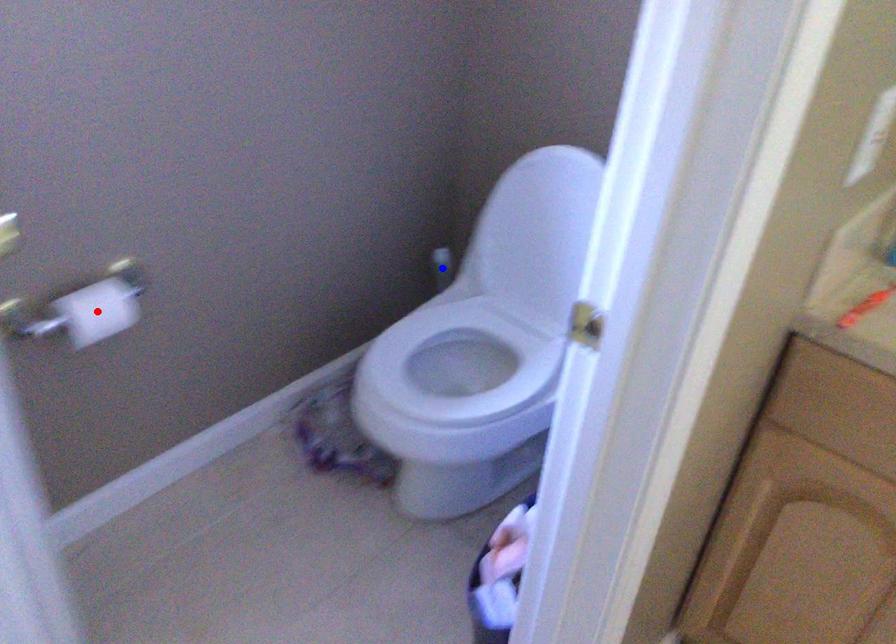
Question: In the image, two points are highlighted. Which point is nearer to the camera? Reply with the corresponding letter.

Choices:
 (A) blue point
 (B) red point

Answer: (B)